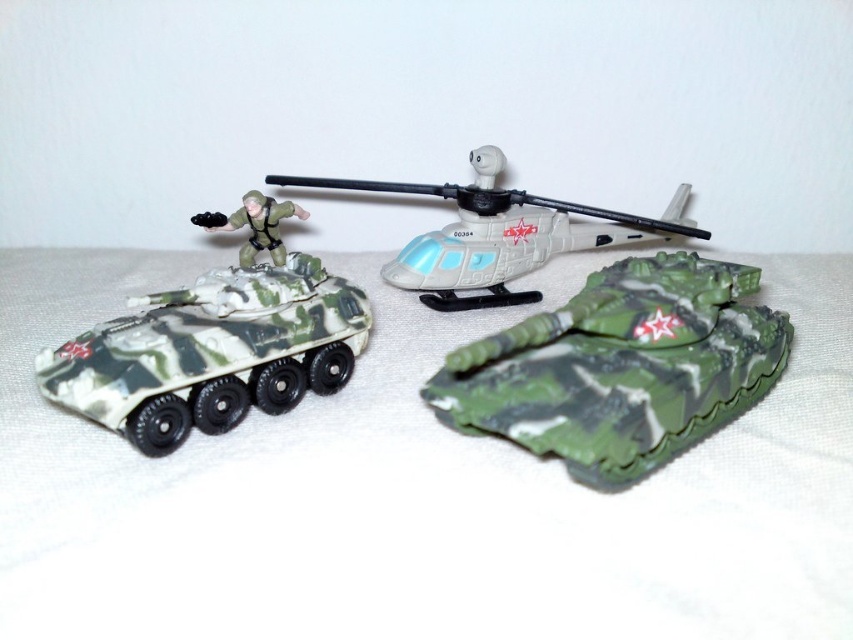
What are the coordinates of the camouflage plastic tank at center?

The camouflage plastic tank at center is located at coordinates 0.575 and 0.729.

From the picture: You are a drone operator viewing the miniature military scene. You need to determine which of the two points, point 1 at coordinates (160, 417) or point 2 at (477, 228), is closer to your camera. Which point is closer?

Point 1 at coordinates (160, 417) is closer to the camera than point 2 at (477, 228).

You are a toy collector who wants to display the camouflage plastic tank at center on a shelf that is 30 inches away from the wall. Can the tank be placed on the shelf without being too close to the wall?

The camouflage plastic tank at center is 31.35 inches from the camera, so it would be too close to the wall if placed on the shelf since the shelf is only 30 inches away from the wall.